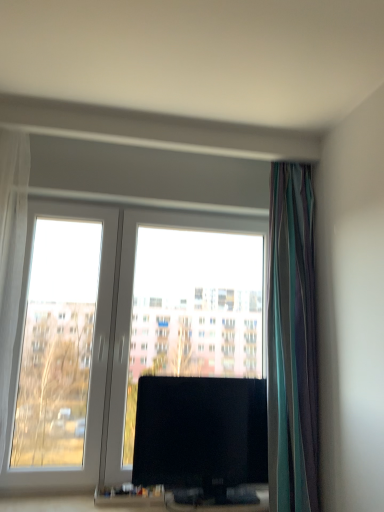
Question: Does transparent glass window at center appear on the right side of white sheer curtain at left, which is the 2th curtain from right to left?

Choices:
 (A) no
 (B) yes

Answer: (B)

Question: Is the depth of transparent glass window at center greater than that of white sheer curtain at left, which is the 1th curtain in left-to-right order?

Choices:
 (A) yes
 (B) no

Answer: (A)

Question: From the image's perspective, is transparent glass window at center located beneath white sheer curtain at left, which is the 2th curtain from right to left?

Choices:
 (A) yes
 (B) no

Answer: (A)

Question: Is transparent glass window at center aimed at white sheer curtain at left, which is the 1th curtain in left-to-right order?

Choices:
 (A) no
 (B) yes

Answer: (B)

Question: From a real-world perspective, is transparent glass window at center physically above white sheer curtain at left, which is the 2th curtain from right to left?

Choices:
 (A) no
 (B) yes

Answer: (A)

Question: Is transparent glass window at center smaller than white sheer curtain at left, which is the 2th curtain from right to left?

Choices:
 (A) no
 (B) yes

Answer: (A)

Question: Considering the relative sizes of transparent glass window at center and striped fabric curtain at right, marked as the 2th curtain in a left-to-right arrangement, in the image provided, is transparent glass window at center bigger than striped fabric curtain at right, marked as the 2th curtain in a left-to-right arrangement,?

Choices:
 (A) no
 (B) yes

Answer: (B)

Question: Considering the relative sizes of transparent glass window at center and striped fabric curtain at right, marked as the 2th curtain in a left-to-right arrangement, in the image provided, is transparent glass window at center wider than striped fabric curtain at right, marked as the 2th curtain in a left-to-right arrangement,?

Choices:
 (A) yes
 (B) no

Answer: (B)

Question: From a real-world perspective, is transparent glass window at center located higher than striped fabric curtain at right, marked as the 2th curtain in a left-to-right arrangement?

Choices:
 (A) yes
 (B) no

Answer: (B)

Question: Is transparent glass window at center positioned before striped fabric curtain at right, marked as the 2th curtain in a left-to-right arrangement?

Choices:
 (A) no
 (B) yes

Answer: (A)

Question: Does transparent glass window at center turn towards striped fabric curtain at right, marked as the 2th curtain in a left-to-right arrangement?

Choices:
 (A) yes
 (B) no

Answer: (A)

Question: Is striped fabric curtain at right, marked as the 2th curtain in a left-to-right arrangement, surrounded by transparent glass window at center?

Choices:
 (A) no
 (B) yes

Answer: (A)

Question: From a real-world perspective, is white sheer curtain at left, which is the 1th curtain in left-to-right order, under striped fabric curtain at right, marked as the 2th curtain in a left-to-right arrangement?

Choices:
 (A) yes
 (B) no

Answer: (B)